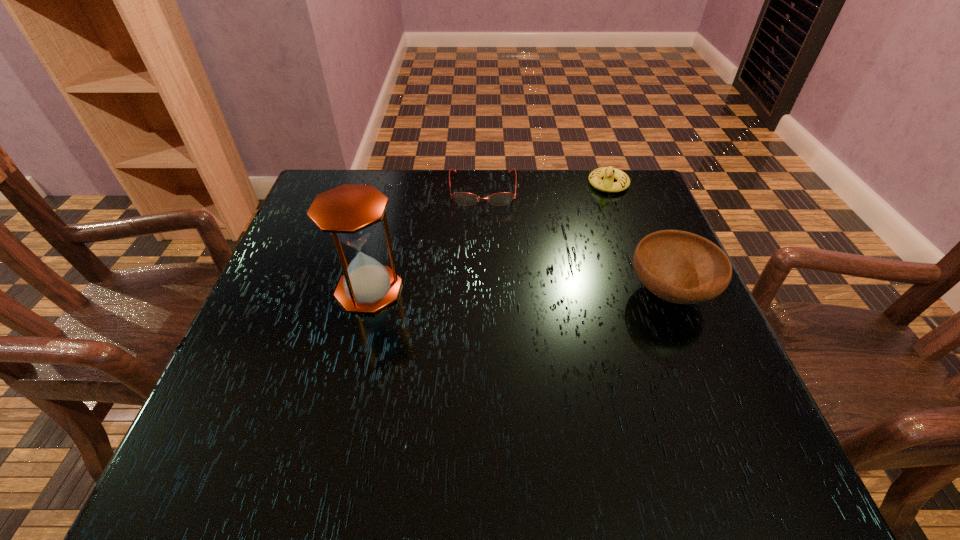
In order to click on free space located on the face of the third tallest object in this screenshot , I will do tap(591, 218).

I want to click on free space located 0.240m on the lenses of the shortest object, so click(485, 274).

Identify the location of vacant region located on the lenses of the shortest object. (485, 291).

You are a GUI agent. You are given a task and a screenshot of the screen. Output one action in this format:
    pyautogui.click(x=<x>, y=<y>)
    Task: Click on the free space located on the lenses of the shortest object
    
    Given the screenshot: What is the action you would take?
    pyautogui.click(x=484, y=238)

At what (x,y) coordinates should I click in order to perform the action: click on duckling at the far edge. Please return your answer as a coordinate pair (x, y). The width and height of the screenshot is (960, 540). Looking at the image, I should click on (609, 173).

I want to click on spectacles that is at the far edge, so click(x=463, y=198).

At what (x,y) coordinates should I click in order to perform the action: click on object located at the left edge. Please return your answer as a coordinate pair (x, y). Looking at the image, I should click on (350, 213).

Find the location of a particular element. Image resolution: width=960 pixels, height=540 pixels. bowl situated at the right edge is located at coordinates (681, 267).

Locate an element on the screen. duckling that is at the right edge is located at coordinates (609, 173).

The image size is (960, 540). I want to click on object that is at the far right corner, so click(609, 173).